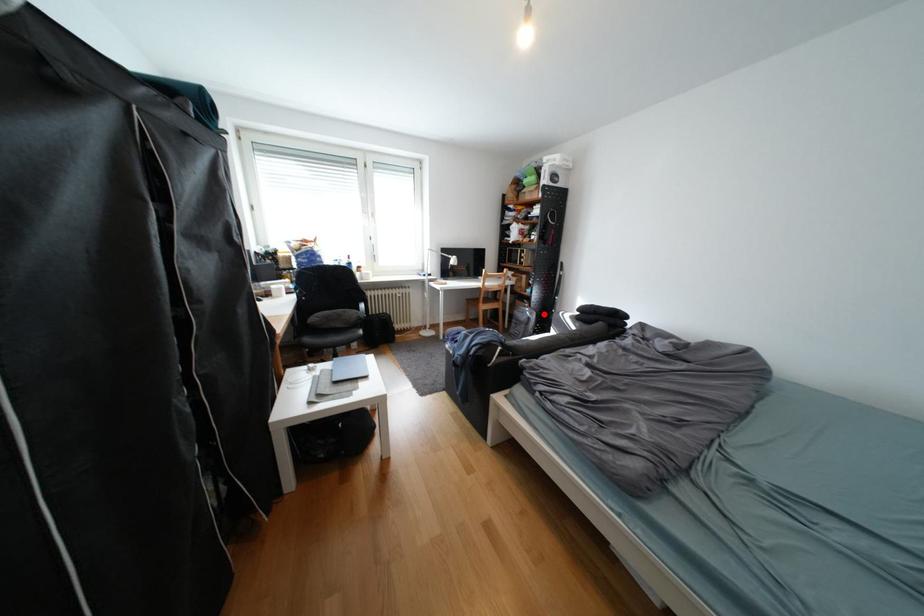
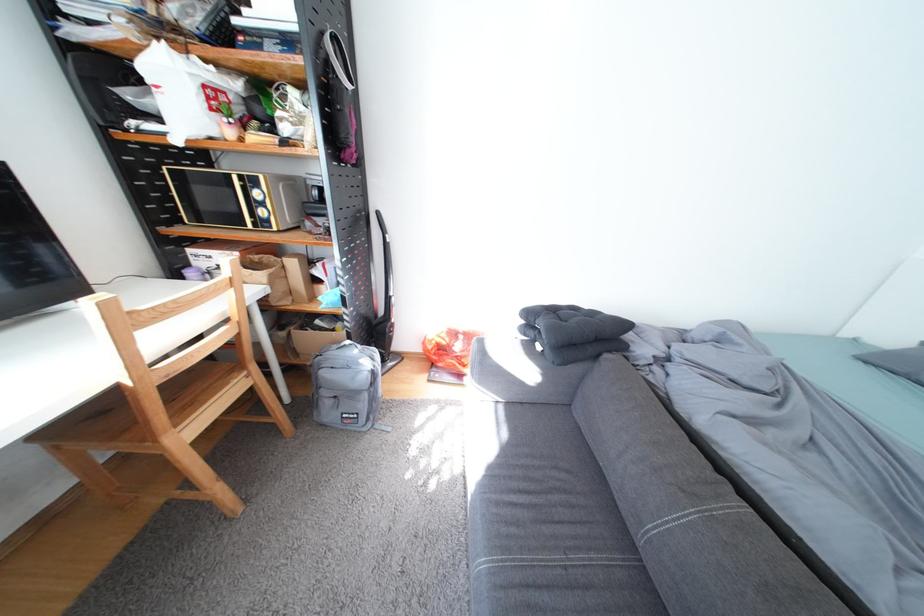
Where in the second image is the point corresponding to the highlighted location from the first image?

(385, 360)